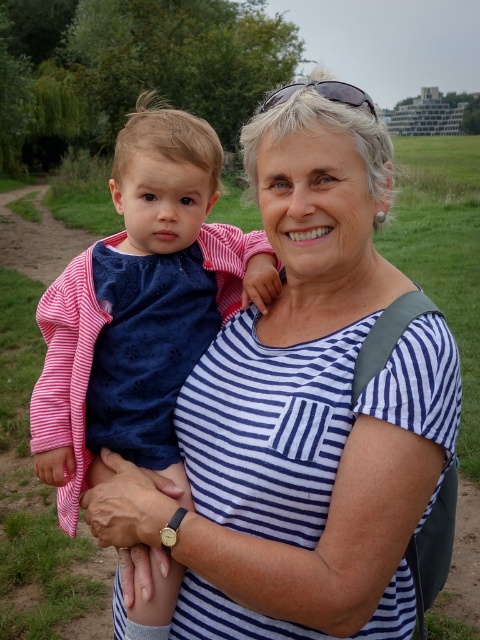
Does point (131, 508) come in front of point (83, 257)?

Yes, point (131, 508) is closer to viewer.

What do you see at coordinates (302, 410) in the screenshot? I see `white striped shirt at center` at bounding box center [302, 410].

Between point (322, 312) and point (163, 422), which one is positioned behind?

Point (163, 422)

This screenshot has height=640, width=480. I want to click on white striped shirt at center, so click(x=302, y=410).